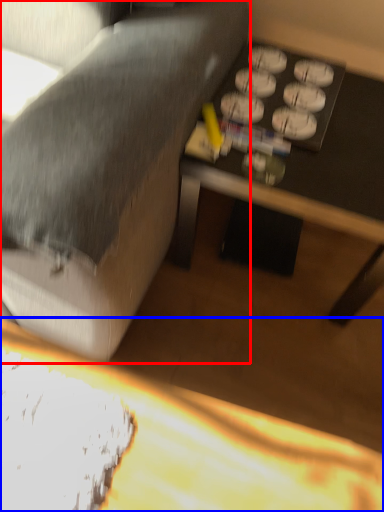
Question: Which of the following is the farthest to the observer, studio couch (highlighted by a red box) or table (highlighted by a blue box)?

Choices:
 (A) studio couch
 (B) table

Answer: (B)